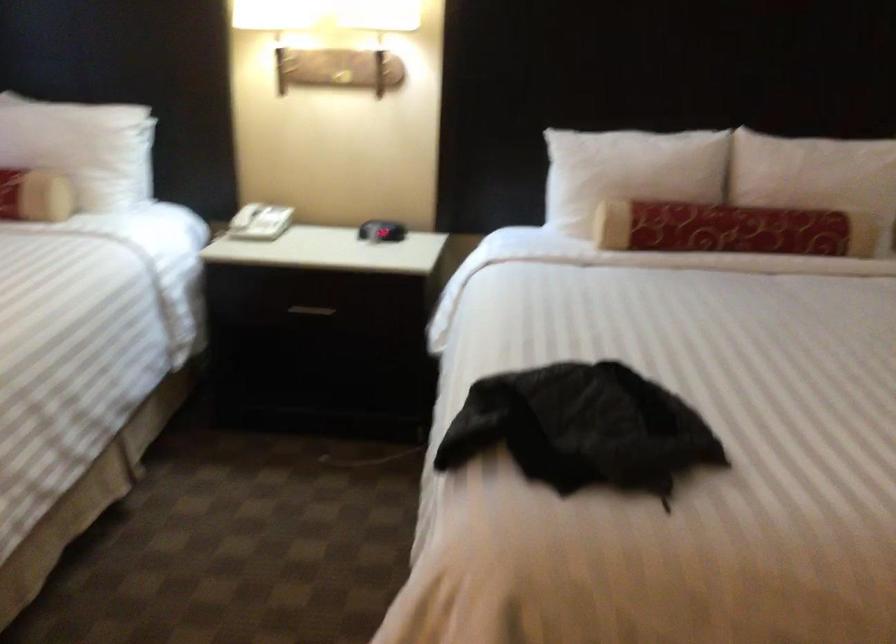
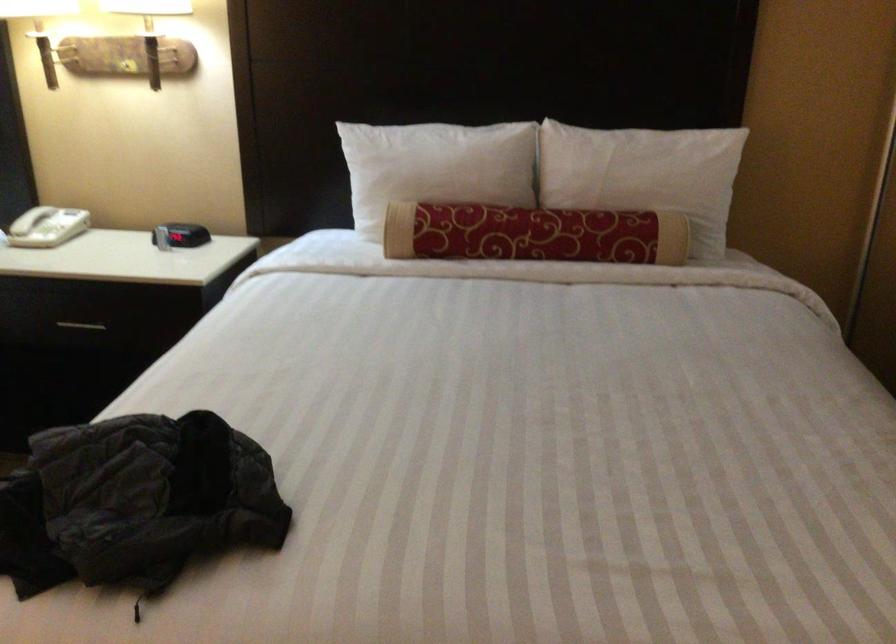
Where in the second image is the point corresponding to point (254, 216) from the first image?

(30, 220)